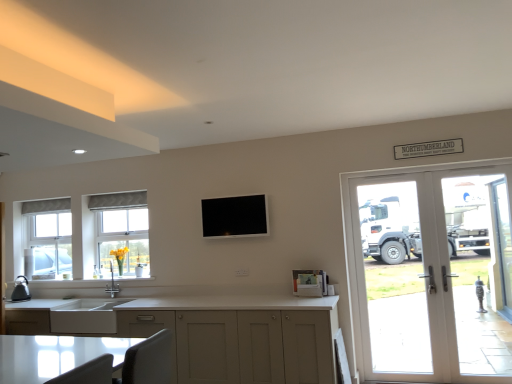
Identify the location of empty space that is ontop of white glass screen door at right, which is the second screen door in right-to-left order (from a real-world perspective). tap(464, 167).